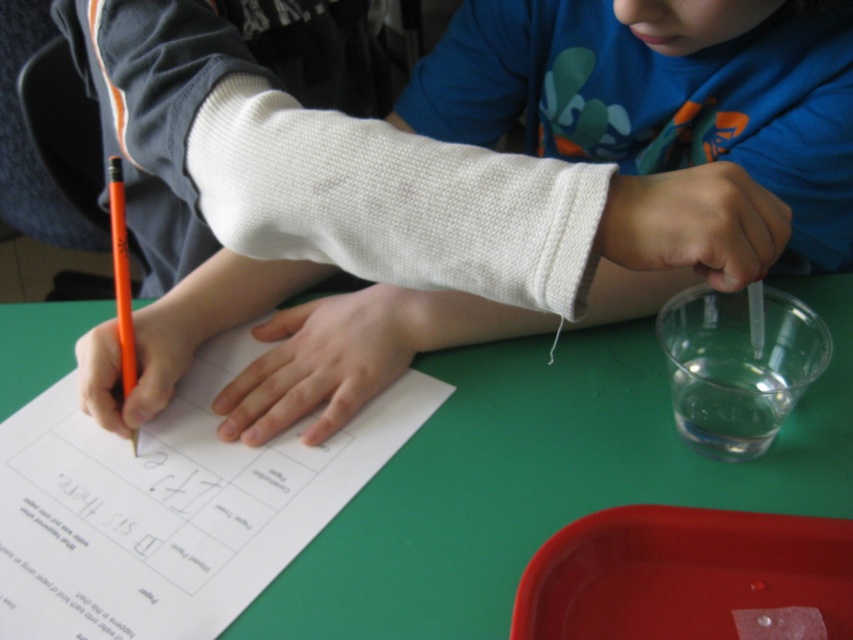
Question: Can you confirm if green matte table at center is positioned below orange matte pencil at left?

Choices:
 (A) yes
 (B) no

Answer: (A)

Question: Based on their relative distances, which object is nearer to the orange matte pencil at left?

Choices:
 (A) white knitted cast at upper center
 (B) white paper at center

Answer: (B)

Question: Which of the following is the farthest from the observer?

Choices:
 (A) (123, 237)
 (B) (767, 372)
 (C) (149, 445)
 (D) (432, 554)

Answer: (B)

Question: Observing the image, what is the correct spatial positioning of white knitted cast at upper center in reference to white paper at center?

Choices:
 (A) below
 (B) above

Answer: (B)

Question: Which object appears farthest from the camera in this image?

Choices:
 (A) green matte table at center
 (B) white paper at center
 (C) white knitted cast at upper center

Answer: (C)

Question: Can you confirm if white paper at center is positioned below orange matte pencil at left?

Choices:
 (A) no
 (B) yes

Answer: (B)